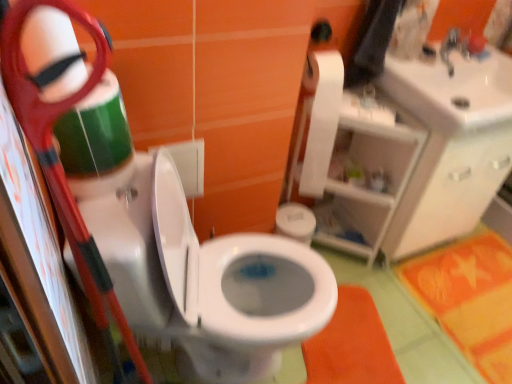
Question: Is orange/yellow fabric bath mat at lower right, the 2th bath mat from the left, positioned with its back to white glossy sink at upper right?

Choices:
 (A) no
 (B) yes

Answer: (A)

Question: Can you confirm if orange/yellow fabric bath mat at lower right, the 2th bath mat from the left, is bigger than white glossy sink at upper right?

Choices:
 (A) no
 (B) yes

Answer: (A)

Question: Is orange/yellow fabric bath mat at lower right, the first bath mat positioned from the right, shorter than white glossy sink at upper right?

Choices:
 (A) no
 (B) yes

Answer: (B)

Question: Is orange/yellow fabric bath mat at lower right, the first bath mat positioned from the right, in front of white glossy sink at upper right?

Choices:
 (A) no
 (B) yes

Answer: (A)

Question: Could you tell me if orange/yellow fabric bath mat at lower right, the 2th bath mat from the left, is turned towards white glossy sink at upper right?

Choices:
 (A) yes
 (B) no

Answer: (B)

Question: Is orange/yellow fabric bath mat at lower right, the first bath mat positioned from the right, thinner than white glossy sink at upper right?

Choices:
 (A) no
 (B) yes

Answer: (A)

Question: From a real-world perspective, is orange/yellow fabric bath mat at lower right, the first bath mat positioned from the right, beneath orange fabric bath mat at lower center, which is the first bath mat in left-to-right order?

Choices:
 (A) yes
 (B) no

Answer: (A)

Question: Is orange/yellow fabric bath mat at lower right, the first bath mat positioned from the right, at the left side of orange fabric bath mat at lower center, which is the first bath mat in left-to-right order?

Choices:
 (A) yes
 (B) no

Answer: (B)

Question: Can you confirm if orange/yellow fabric bath mat at lower right, the first bath mat positioned from the right, is positioned to the right of orange fabric bath mat at lower center, which is the first bath mat in left-to-right order?

Choices:
 (A) no
 (B) yes

Answer: (B)

Question: From a real-world perspective, is orange/yellow fabric bath mat at lower right, the 2th bath mat from the left, positioned over orange fabric bath mat at lower center, which is the first bath mat in left-to-right order, based on gravity?

Choices:
 (A) no
 (B) yes

Answer: (A)

Question: Is orange/yellow fabric bath mat at lower right, the 2th bath mat from the left, outside orange fabric bath mat at lower center, the second bath mat viewed from the right?

Choices:
 (A) no
 (B) yes

Answer: (B)

Question: Can orange fabric bath mat at lower center, the second bath mat viewed from the right, be found inside orange/yellow fabric bath mat at lower right, the first bath mat positioned from the right?

Choices:
 (A) no
 (B) yes

Answer: (A)

Question: Does white matte toilet paper at upper right have a larger size compared to orange fabric bath mat at lower center, which is the first bath mat in left-to-right order?

Choices:
 (A) yes
 (B) no

Answer: (B)